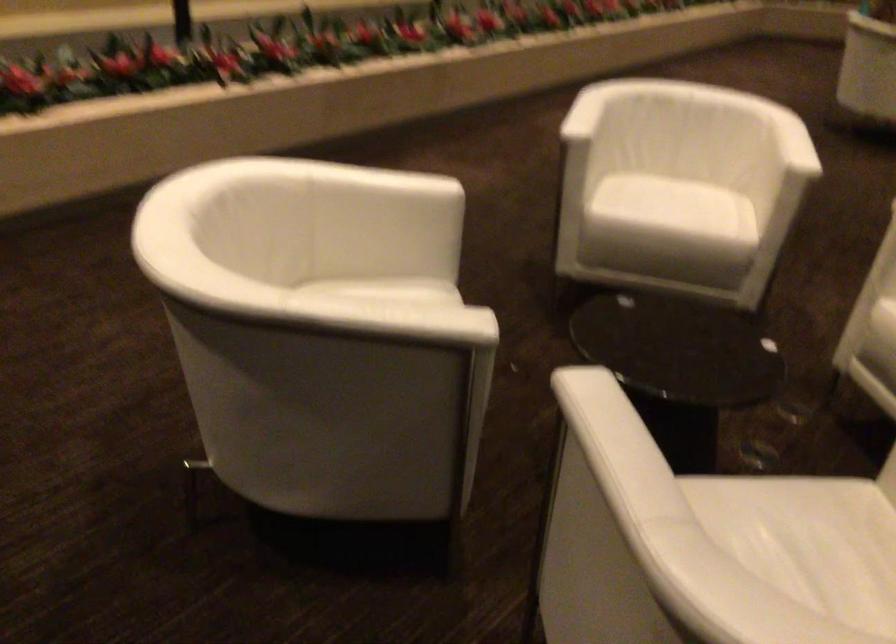
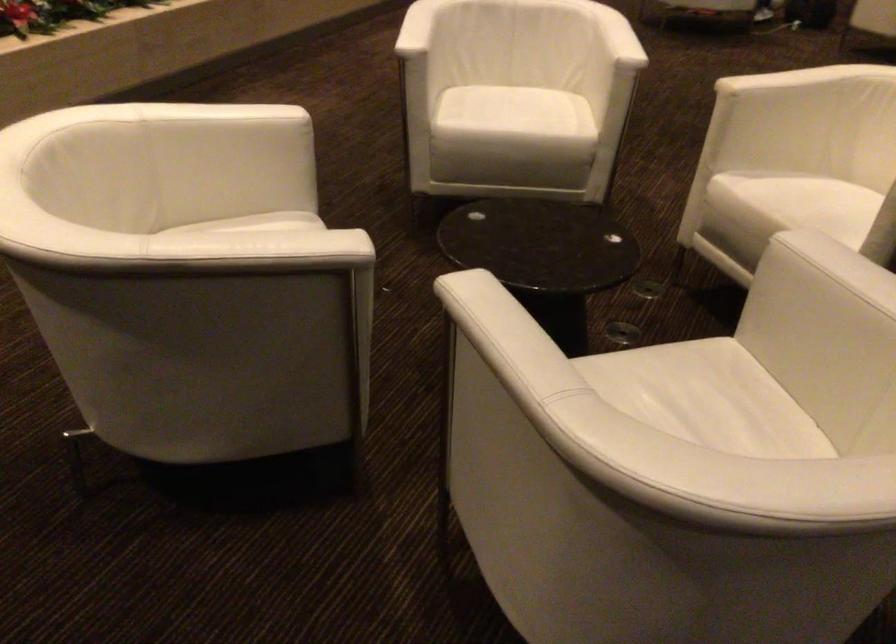
Find the pixel in the second image that matches point (582, 109) in the first image.

(417, 28)